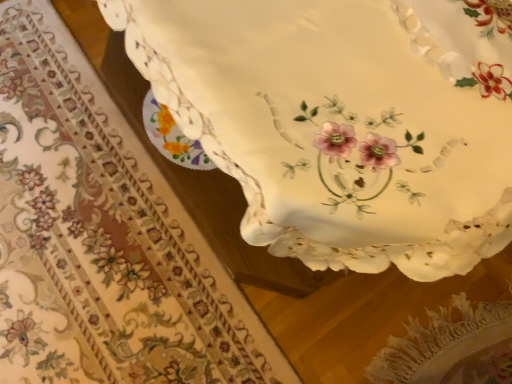
At what (x,y) coordinates should I click in order to perform the action: click on white satin cake at upper center. Please return your answer as a coordinate pair (x, y). Image resolution: width=512 pixels, height=384 pixels. Looking at the image, I should click on (345, 121).

Describe the element at coordinates (345, 121) in the screenshot. This screenshot has height=384, width=512. I see `white satin cake at upper center` at that location.

What is the approximate width of white satin cake at upper center?

white satin cake at upper center is 22.53 inches in width.

In order to click on white satin cake at upper center in this screenshot , I will do `click(345, 121)`.